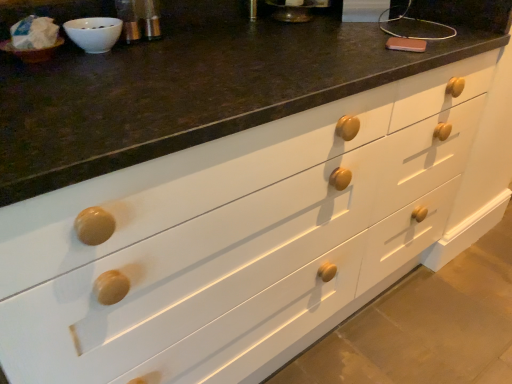
This screenshot has width=512, height=384. I want to click on white glossy bowl at upper left, so click(x=94, y=33).

The height and width of the screenshot is (384, 512). What do you see at coordinates (94, 33) in the screenshot?
I see `white glossy bowl at upper left` at bounding box center [94, 33].

Where is `white glossy bowl at upper left`? white glossy bowl at upper left is located at coordinates (94, 33).